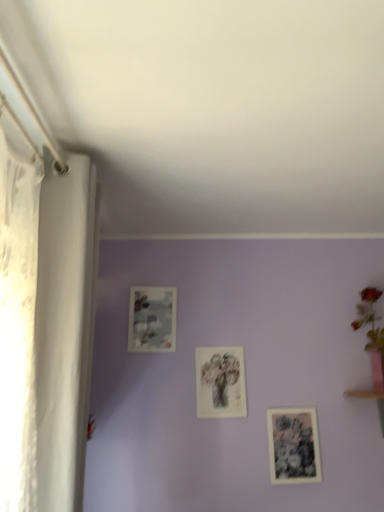
Question: Based on their sizes in the image, would you say pink ceramic vase at upper right is bigger or smaller than matte floral print at center, arranged as the 2th picture frame when viewed from the left?

Choices:
 (A) big
 (B) small

Answer: (A)

Question: Visually, is pink ceramic vase at upper right positioned to the left or to the right of matte floral print at center, which appears as the second picture frame when ordered from the bottom?

Choices:
 (A) left
 (B) right

Answer: (B)

Question: Which object is the farthest from the matte floral print at upper center, placed as the 1th picture frame when sorted from left to right?

Choices:
 (A) matte floral print at center, arranged as the 2th picture frame when viewed from the left
 (B) black paper picture frame at lower right, acting as the first picture frame starting from the bottom
 (C) white sheer curtain at left
 (D) pink ceramic vase at upper right

Answer: (D)

Question: Considering the real-world distances, which object is closest to the black paper picture frame at lower right, the third picture frame from the top?

Choices:
 (A) white sheer curtain at left
 (B) matte floral print at center, which is the 2th picture frame in right-to-left order
 (C) pink ceramic vase at upper right
 (D) matte floral print at upper center, positioned as the 1th picture frame in top-to-bottom order

Answer: (B)